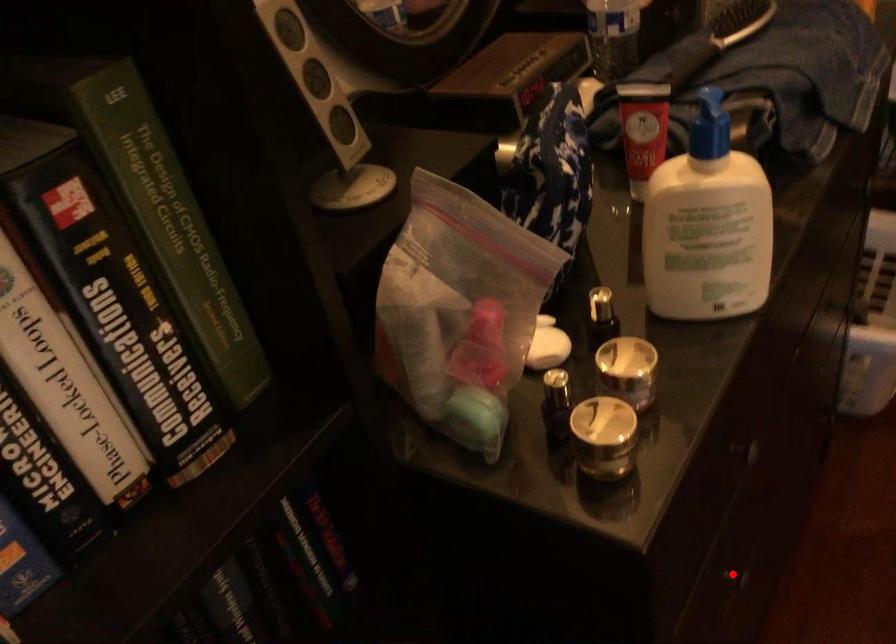
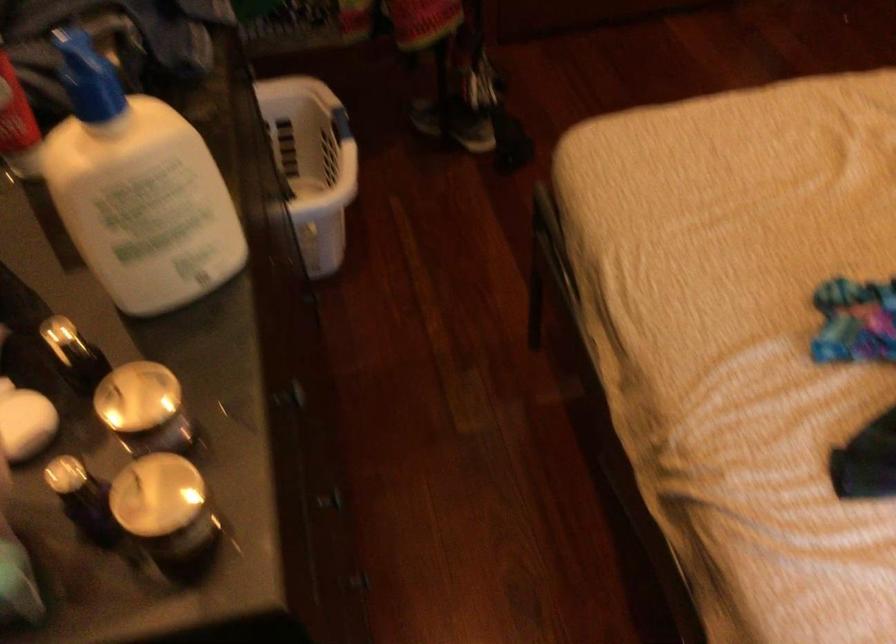
In the second image, find the point that corresponds to the highlighted location in the first image.

(330, 500)